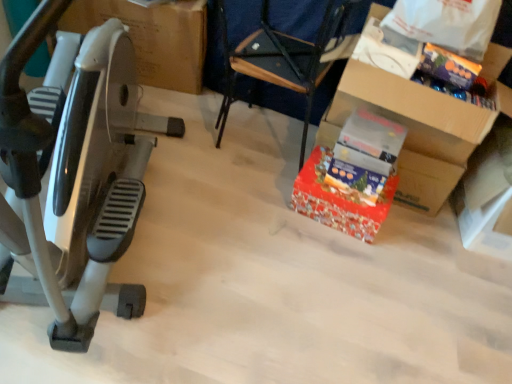
The height and width of the screenshot is (384, 512). What are the coordinates of `vacant area that lies between blue fabric armchair at center and silver metallic stationary bicycle at left` in the screenshot? It's located at (214, 200).